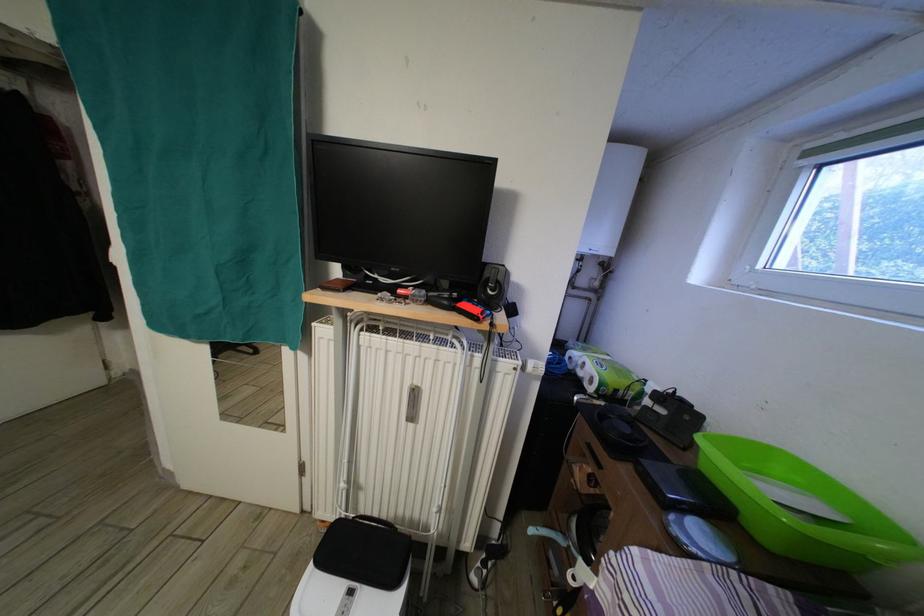
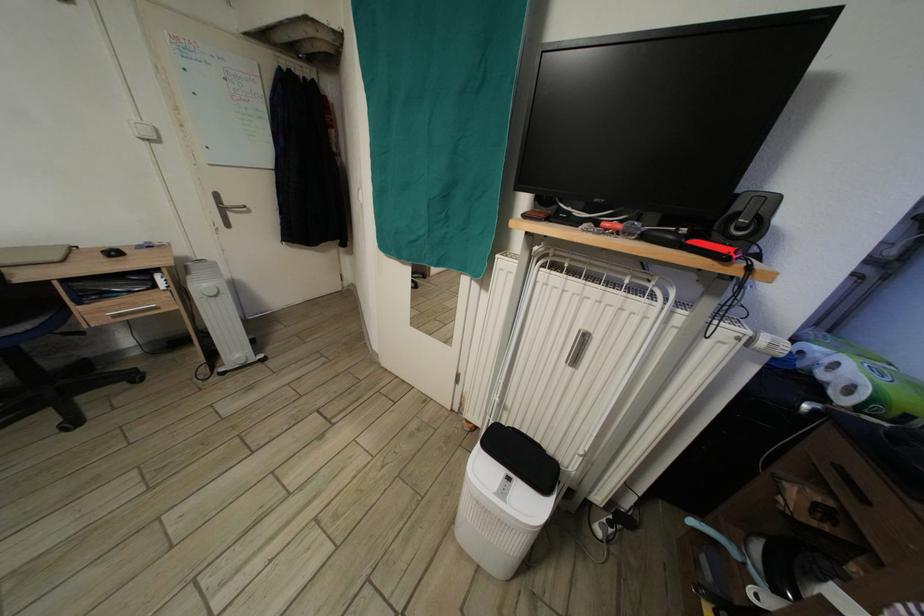
Locate, in the second image, the point that corresponds to (x=453, y=309) in the first image.

(675, 245)